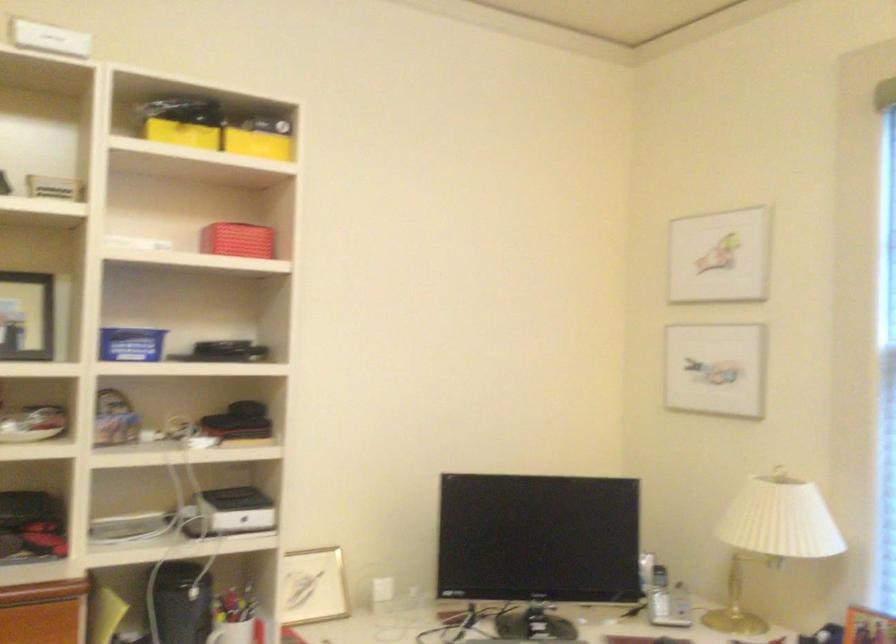
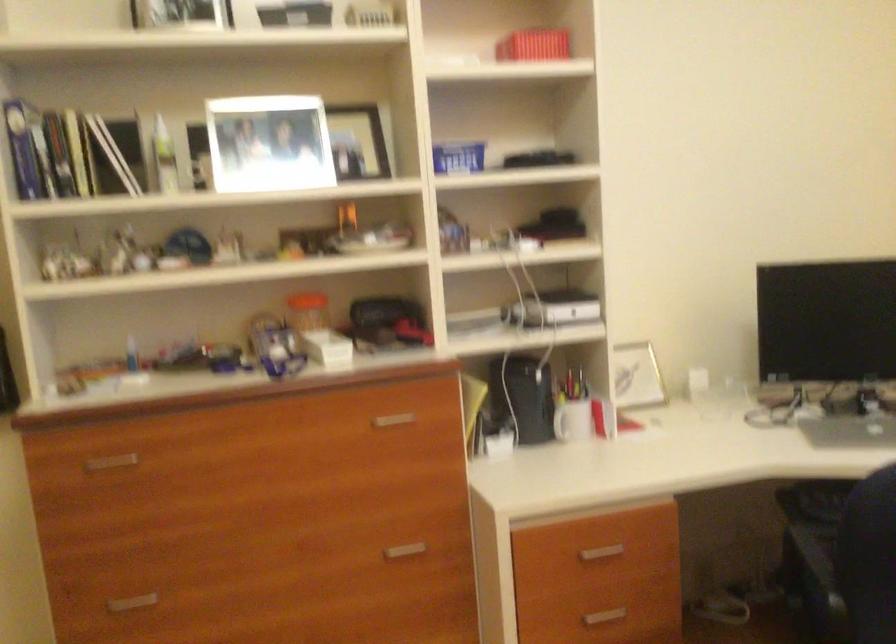
Find the pixel in the second image that matches point (236, 243) in the first image.

(533, 44)